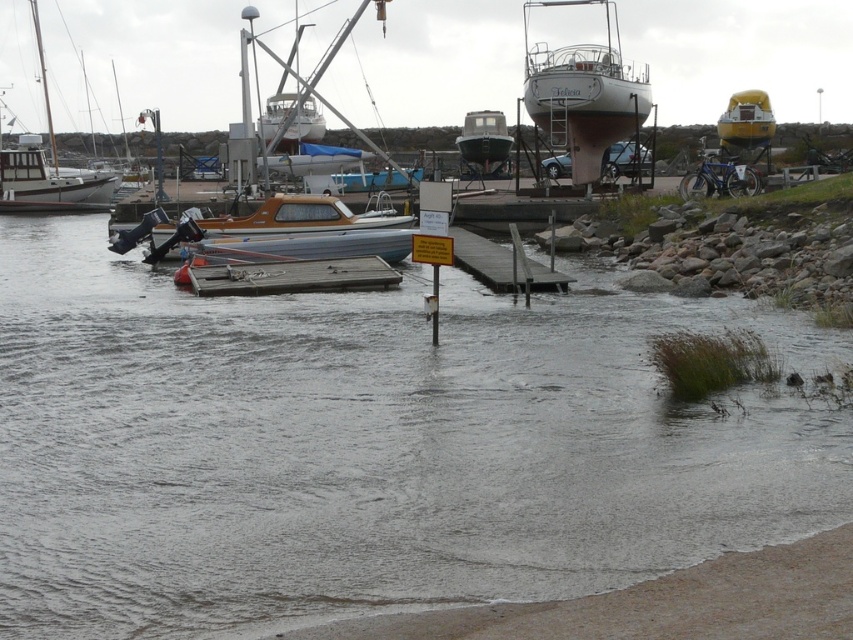
Question: Is metallic gray boat at center thinner than yellow matte boat at upper right?

Choices:
 (A) yes
 (B) no

Answer: (B)

Question: Which of the following is the closest to the observer?

Choices:
 (A) yellow matte boat at upper right
 (B) clear water at lower center

Answer: (B)

Question: Can you confirm if wooden polished boat at center is bigger than brushed metal boat at left?

Choices:
 (A) yes
 (B) no

Answer: (A)

Question: Which object is the farthest from the white glossy boat at center?

Choices:
 (A) yellow matte boat at upper right
 (B) brushed metal boat at left
 (C) metallic gray boat at center

Answer: (B)

Question: Which point appears closest to the camera in this image?

Choices:
 (A) pos(488,161)
 (B) pos(215,228)

Answer: (B)

Question: Does brushed metal boat at left have a lesser width compared to yellow matte boat at upper right?

Choices:
 (A) yes
 (B) no

Answer: (B)